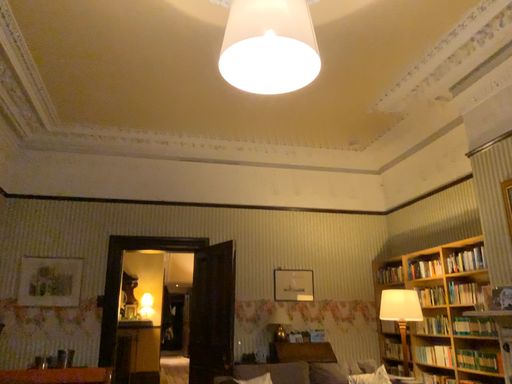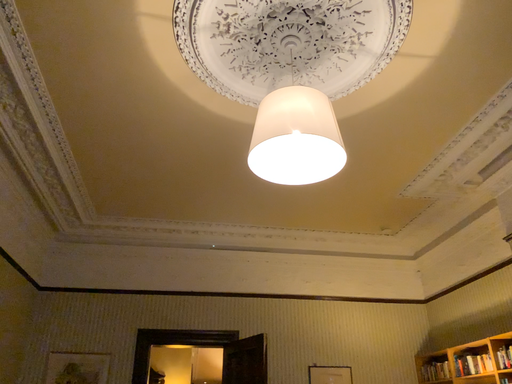
Question: How did the camera likely rotate when shooting the video?

Choices:
 (A) rotated downward
 (B) rotated upward

Answer: (B)